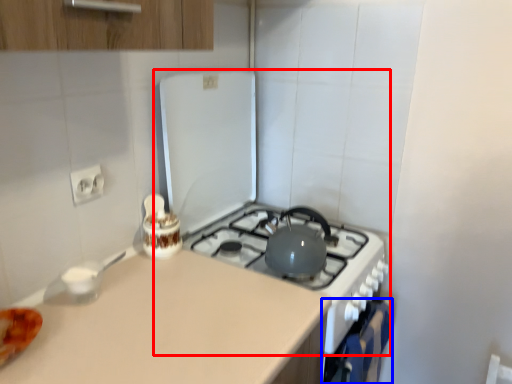
Question: Among these objects, which one is nearest to the camera, appliance (highlighted by a red box) or oven (highlighted by a blue box)?

Choices:
 (A) appliance
 (B) oven

Answer: (A)